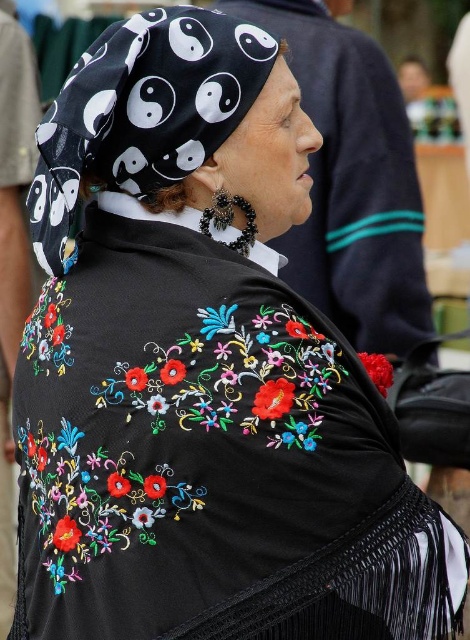
You are a fashion designer who wants to create a matching accessory for the black embroidered poncho at center and the black printed fabric headscarf at upper left. Which one requires a larger accessory to maintain proportion?

The black embroidered poncho at center requires a larger accessory because it is bigger than the black printed fabric headscarf at upper left.

You are an anthropologist studying traditional clothing. You observe the black embroidered poncho at center and the black printed fabric headscarf at upper left in the image. Which item is positioned higher relative to the other?

The black embroidered poncho at center is located above the black printed fabric headscarf at upper left, so the poncho is positioned higher.